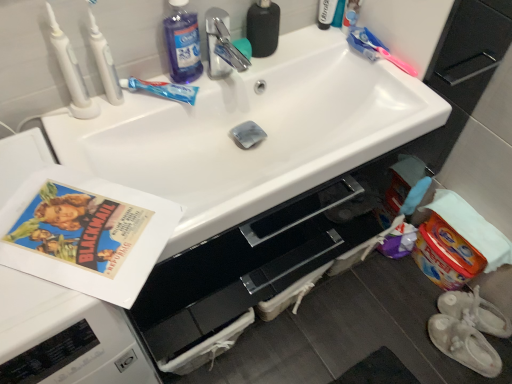
Locate an element on the screen. This screenshot has height=384, width=512. free space on the front side of white plastic toothbrush at upper left, placed as the 3th toothbrush when sorted from right to left is located at coordinates (94, 137).